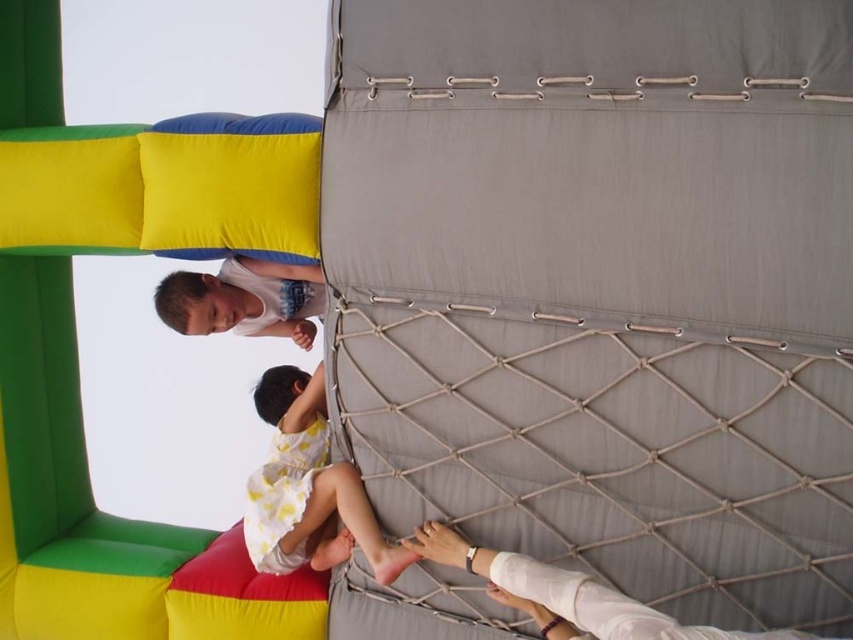
Can you confirm if white cotton dress at lower center is positioned below matte white shirt at upper left?

Indeed, white cotton dress at lower center is positioned under matte white shirt at upper left.

Which is behind, point (308, 429) or point (288, 324)?

Point (288, 324)

Is point (293, 410) in front of point (236, 268)?

Yes, point (293, 410) is closer to viewer.

The width and height of the screenshot is (853, 640). What are the coordinates of `white cotton dress at lower center` in the screenshot? It's located at (308, 486).

Is point (112, 572) positioned behind point (204, 308)?

That is True.

Identify the location of soft yellow cushion at upper left. The image size is (853, 640). (76, 344).

Is point (177, 193) closer to camera compared to point (192, 317)?

Yes, it is.

Locate an element on the screen. Image resolution: width=853 pixels, height=640 pixels. soft yellow cushion at upper left is located at coordinates (76, 344).

The width and height of the screenshot is (853, 640). What do you see at coordinates (602, 288) in the screenshot? I see `textured gray netting at upper center` at bounding box center [602, 288].

Can you confirm if textured gray netting at upper center is taller than soft yellow cushion at upper left?

Yes.

Identify the location of textured gray netting at upper center. The height and width of the screenshot is (640, 853). (602, 288).